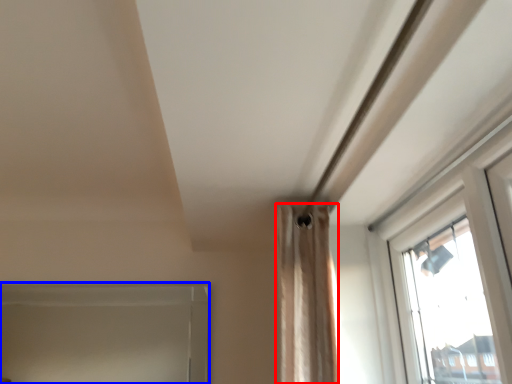
Question: Which point is closer to the camera, curtain (highlighted by a red box) or window frame (highlighted by a blue box)?

Choices:
 (A) curtain
 (B) window frame

Answer: (A)